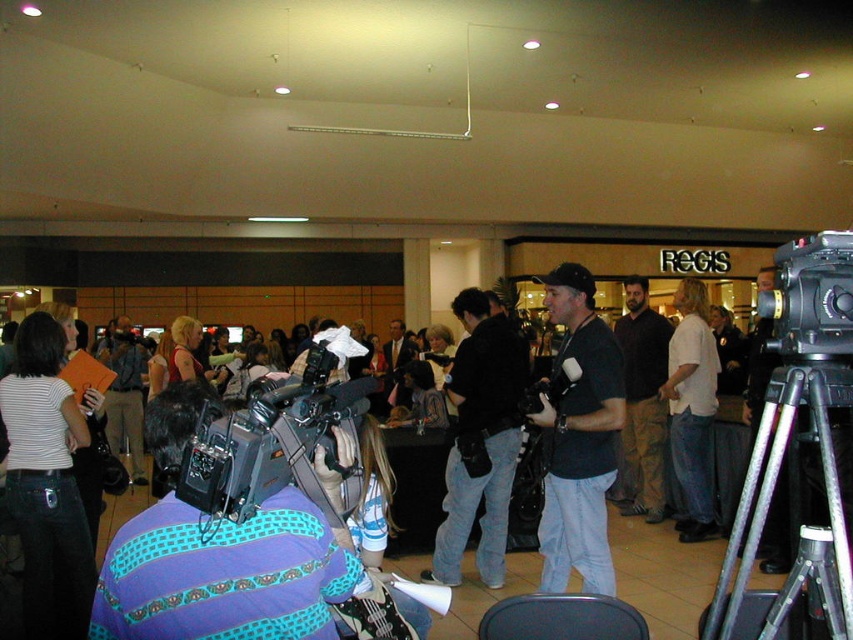
You are at the event and want to locate the matte black shirt at center. What are the coordinates where you can find it?

The matte black shirt at center can be found at coordinates point (579, 440).

You are at a press conference and need to quickly identify two speakers. You see a matte black shirt at center and a white cotton shirt at center. Which speaker is positioned to the left?

The matte black shirt at center is positioned to the left of the white cotton shirt at center.

You are a photographer at the event and need to capture a clear shot of both the matte black shirt at center and the white cotton shirt at center. Since the two shirts are positioned close to each other, which shirt should you focus on first to ensure the subject remains in focus without adjusting the camera settings?

The matte black shirt at center is thinner than the white cotton shirt at center, so focusing on the white cotton shirt at center first would ensure proper focus since it has more depth compared to the thinner matte black shirt at center.